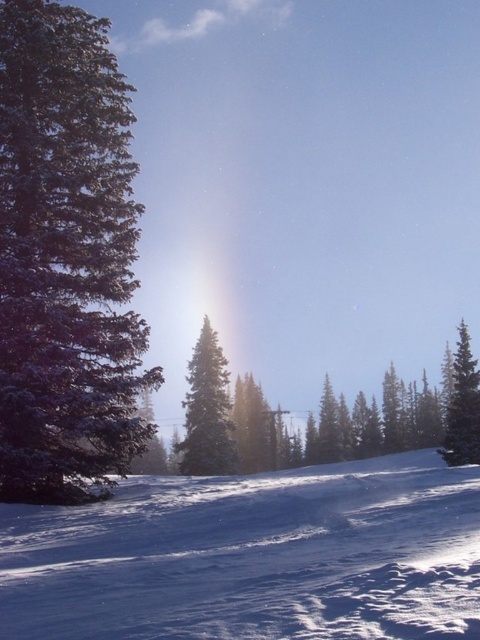
Question: Does white powdery snow at center have a larger size compared to green matte evergreen tree at center?

Choices:
 (A) yes
 (B) no

Answer: (B)

Question: Among these objects, which one is farthest from the camera?

Choices:
 (A) green matte evergreen tree at left
 (B) white powdery snow at center

Answer: (A)

Question: Which object is closer to the camera taking this photo?

Choices:
 (A) green matte tree at right
 (B) green matte evergreen tree at left
 (C) green matte evergreen tree at center

Answer: (B)

Question: Does green matte evergreen tree at left appear under green matte tree at right?

Choices:
 (A) no
 (B) yes

Answer: (A)

Question: Which object is closer to the camera taking this photo?

Choices:
 (A) white powdery snow at center
 (B) green matte evergreen tree at left
 (C) green matte evergreen tree at center

Answer: (A)

Question: Can you confirm if white powdery snow at center is positioned above green matte evergreen tree at left?

Choices:
 (A) no
 (B) yes

Answer: (A)